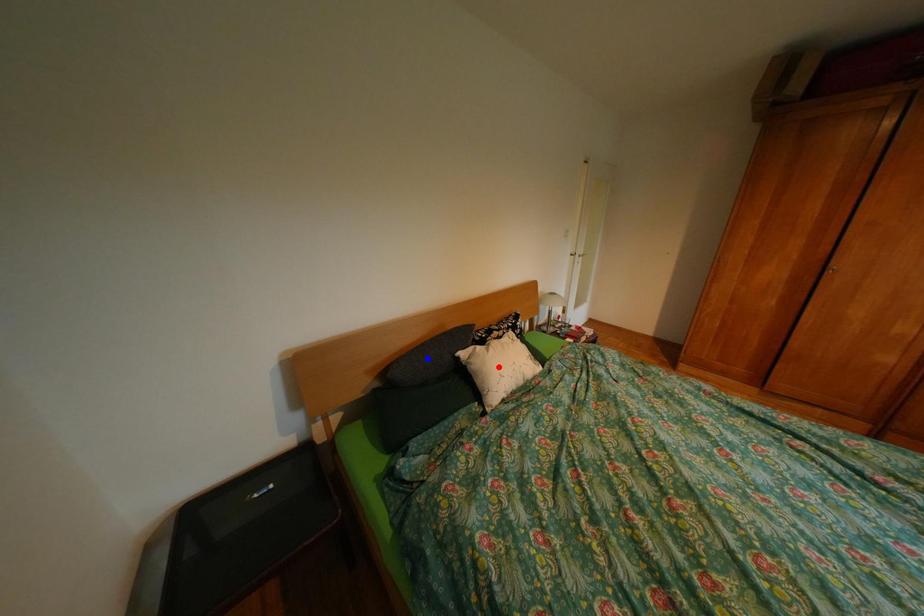
Question: Two points are marked on the image. Which point is closer to the camera?

Choices:
 (A) Blue point is closer.
 (B) Red point is closer.

Answer: (B)